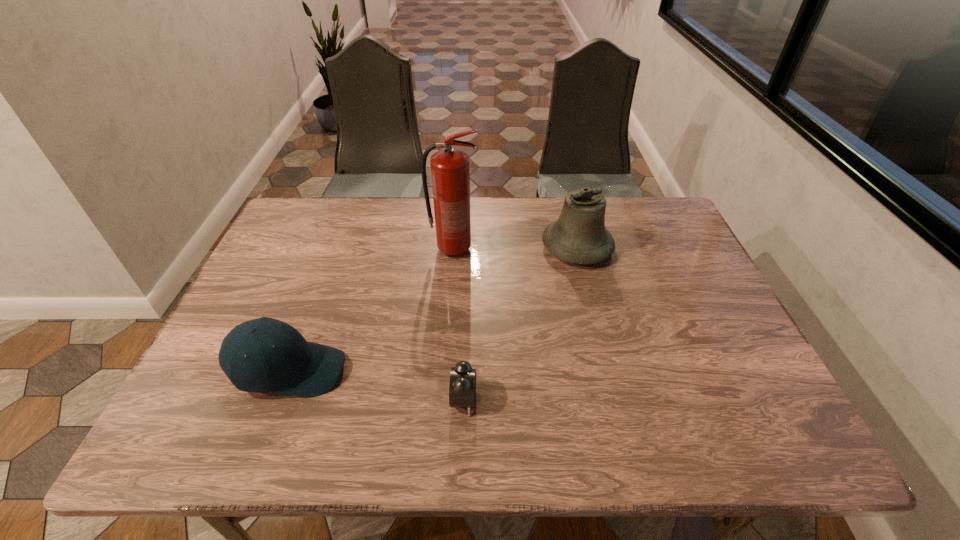
Identify the location of fire extinguisher. Image resolution: width=960 pixels, height=540 pixels. (450, 169).

Locate an element on the screen. The image size is (960, 540). the rightmost object is located at coordinates (579, 236).

Image resolution: width=960 pixels, height=540 pixels. What are the coordinates of `the third shortest object` in the screenshot? It's located at (579, 236).

The height and width of the screenshot is (540, 960). I want to click on the leftmost object, so click(293, 366).

I want to click on the second shortest object, so (293, 366).

You are a GUI agent. You are given a task and a screenshot of the screen. Output one action in this format:
    pyautogui.click(x=<x>, y=<y>)
    Task: Click on the alarm clock
    
    Given the screenshot: What is the action you would take?
    pyautogui.click(x=462, y=389)

The height and width of the screenshot is (540, 960). I want to click on blank space located on the handle side the tallest object, so coord(548,249).

Locate an element on the screen. This screenshot has width=960, height=540. free space located on the left of the bell is located at coordinates (427, 247).

This screenshot has width=960, height=540. In order to click on vacant space located 0.260m on the front-facing side of the third tallest object in this screenshot , I will do `click(462, 370)`.

Identify the location of vacant space positioned on the front side of the shortest object. (542, 399).